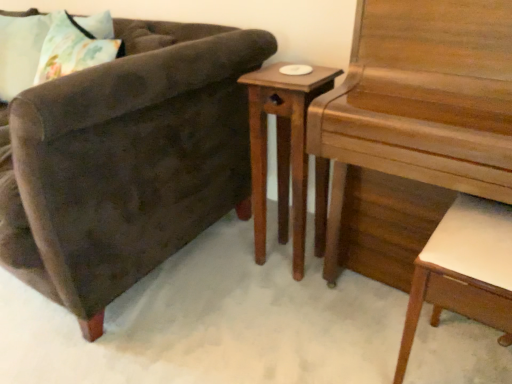
Find the location of a particular element. free space below wooden nightstand at center (from a real-world perspective) is located at coordinates (286, 258).